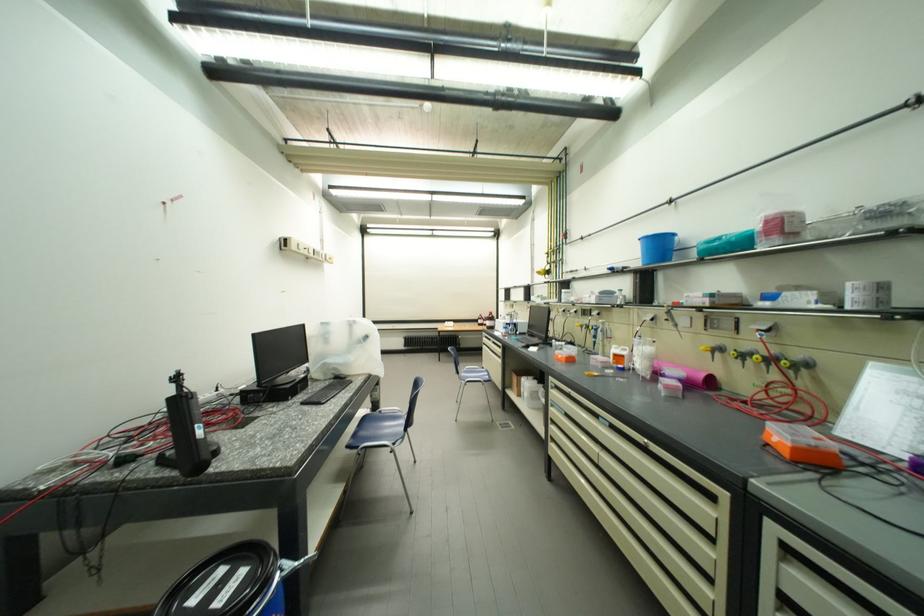
Image resolution: width=924 pixels, height=616 pixels. Describe the element at coordinates (479, 313) in the screenshot. I see `the white pipette` at that location.